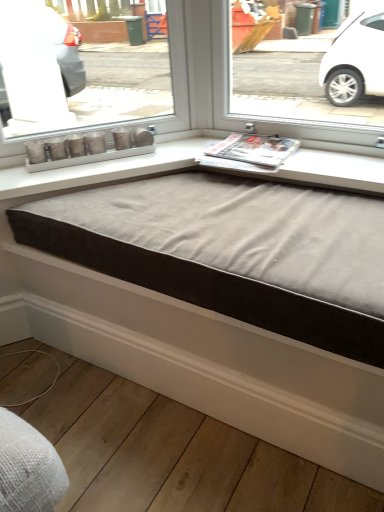
Where is `blank space above matte silver candlesticks at center (from a real-world perspective)`? Image resolution: width=384 pixels, height=512 pixels. blank space above matte silver candlesticks at center (from a real-world perspective) is located at coordinates (94, 138).